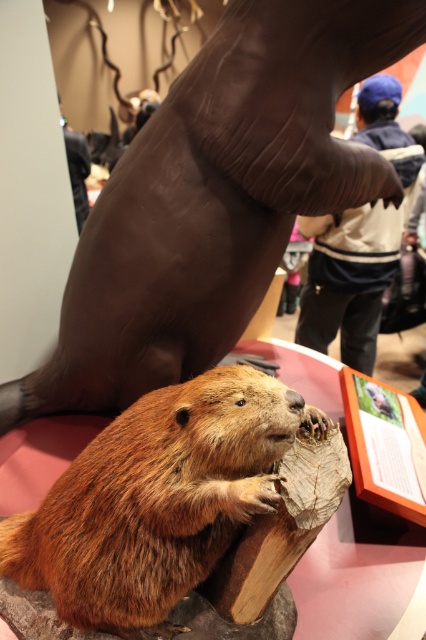
Question: Which object appears closest to the camera in this image?

Choices:
 (A) brown furry beaver at center
 (B) brown fur beaver at lower left
 (C) blue knit cap at upper center

Answer: (A)

Question: Is brown furry beaver at center above blue knit cap at upper center?

Choices:
 (A) yes
 (B) no

Answer: (B)

Question: Can you confirm if blue knit cap at upper center is bigger than brown fur beaver at lower left?

Choices:
 (A) yes
 (B) no

Answer: (B)

Question: Considering the relative positions of brown furry beaver at center and brown fur beaver at lower left in the image provided, where is brown furry beaver at center located with respect to brown fur beaver at lower left?

Choices:
 (A) left
 (B) right

Answer: (B)

Question: Estimate the real-world distances between objects in this image. Which object is closer to the blue knit cap at upper center?

Choices:
 (A) brown furry beaver at center
 (B) brown fur beaver at lower left

Answer: (B)

Question: Among these objects, which one is farthest from the camera?

Choices:
 (A) brown fur beaver at lower left
 (B) blue knit cap at upper center
 (C) brown furry beaver at center

Answer: (A)